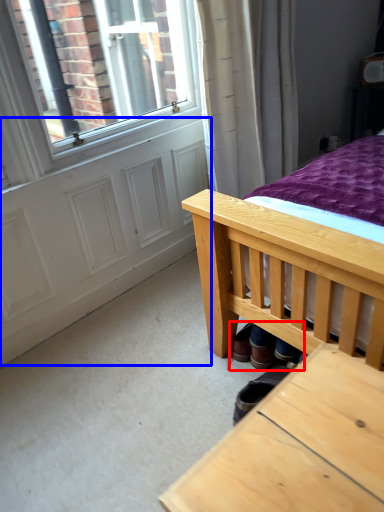
Question: Among these objects, which one is farthest to the camera, shoe (highlighted by a red box) or screen door (highlighted by a blue box)?

Choices:
 (A) shoe
 (B) screen door

Answer: (B)